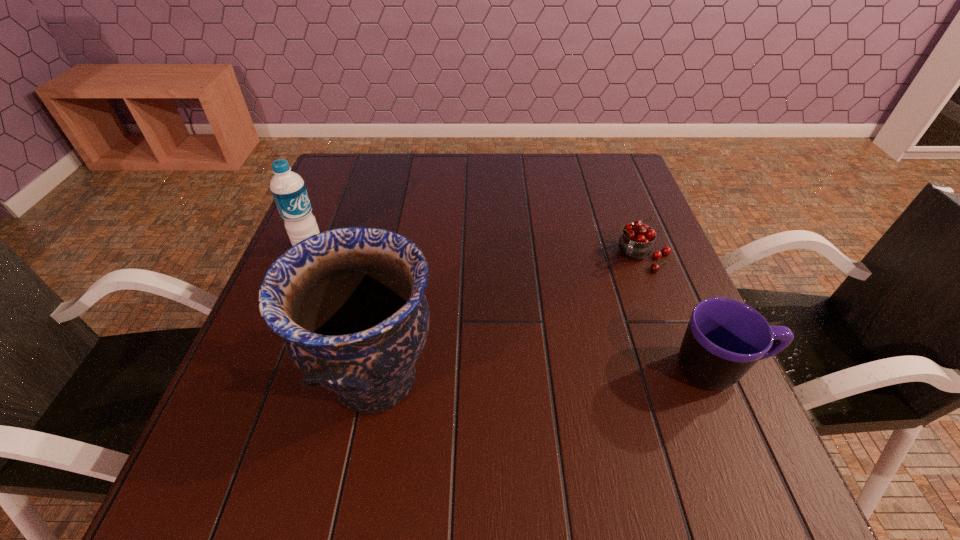
Image resolution: width=960 pixels, height=540 pixels. I want to click on vacant area situated 0.260m on the label of the leftmost object, so click(x=393, y=305).

Identify the location of pottery that is at the near edge. The image size is (960, 540). (349, 303).

Image resolution: width=960 pixels, height=540 pixels. Find the location of `mug located in the near edge section of the desktop`. mug located in the near edge section of the desktop is located at coordinates (725, 338).

Identify the location of pottery that is at the left edge. The width and height of the screenshot is (960, 540). (349, 303).

At what (x,y) coordinates should I click in order to perform the action: click on water bottle present at the left edge. Please return your answer as a coordinate pair (x, y). This screenshot has height=540, width=960. Looking at the image, I should click on (288, 189).

Where is `mug present at the right edge`? This screenshot has width=960, height=540. mug present at the right edge is located at coordinates (725, 338).

Find the location of a particular element. pot filled with cherries that is at the right edge is located at coordinates (636, 242).

Find the location of `object that is at the near left corner`. object that is at the near left corner is located at coordinates (349, 303).

I want to click on object that is at the near right corner, so click(x=725, y=338).

You are a GUI agent. You are given a task and a screenshot of the screen. Output one action in this format:
    pyautogui.click(x=<x>, y=<y>)
    Task: Click on the free space at the far edge of the desktop
    The image size is (960, 540).
    Given the screenshot: What is the action you would take?
    pyautogui.click(x=542, y=197)